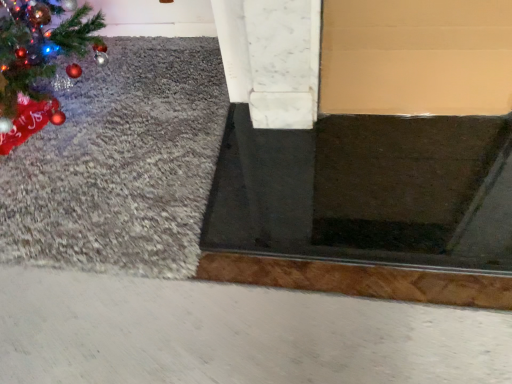
Image resolution: width=512 pixels, height=384 pixels. In order to click on vacant area situated below black rubber doormat at center (from a real-world perspective) in this screenshot , I will do point(374,185).